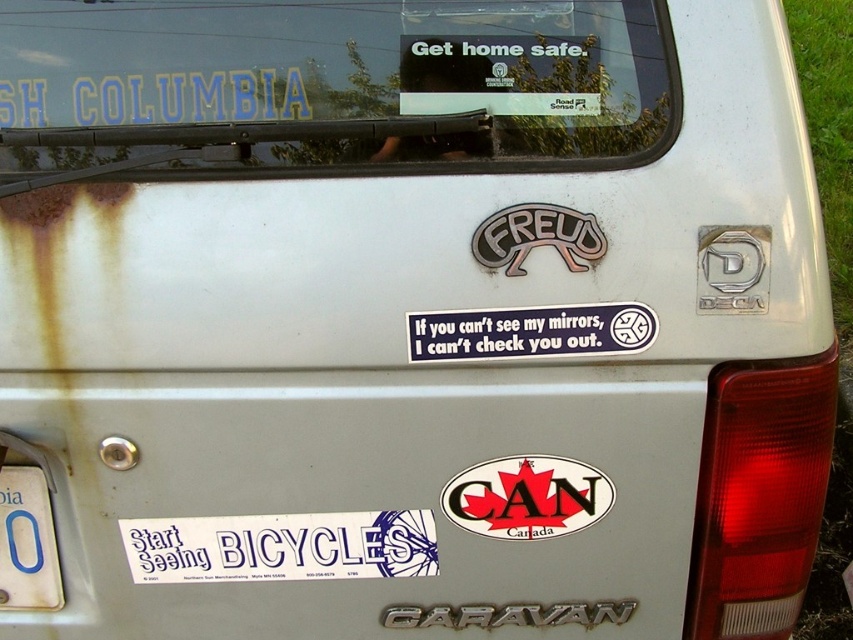
You are a delivery person who needs to attach a label to the trunk of the Dodge Caravan. You have two options for placement based on the existing stickers. The label you need to attach is 3 inches tall. Considering the white paper sticker at lower center and the blue matte sticker at center, which sticker should you choose to ensure your label doesn

The white paper sticker at lower center is taller than the blue matte sticker at center. Since your label is 3 inches tall, you should choose the white paper sticker at lower center because it has more vertical space available compared to the blue matte sticker at center.

You are a delivery person who needs to attach a new sticker to the trunk of the Dodge Caravan. The new sticker must be placed above the white paper sticker at lower center but below the blue matte sticker at center. Is there enough space between them for the new sticker?

The white paper sticker at lower center is positioned under the blue matte sticker at center, so there is space between them where the new sticker can be placed above the white paper sticker at lower center and below the blue matte sticker at center.